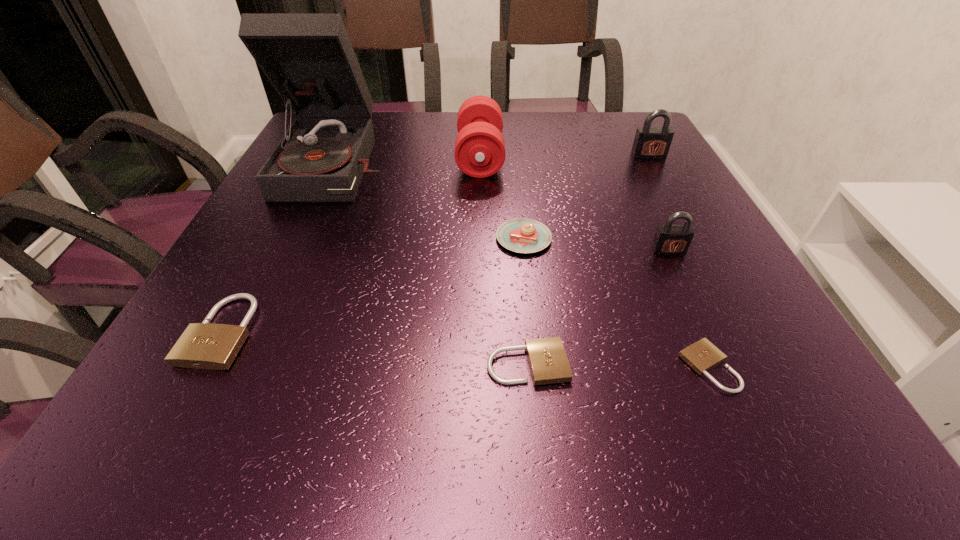
Identify the location of free spot between the third shortest padlock and the second shortest padlock. Image resolution: width=960 pixels, height=540 pixels. (374, 348).

I want to click on unoccupied position between the phonograph_record and the dumbbell, so click(409, 160).

Image resolution: width=960 pixels, height=540 pixels. Find the location of `free space between the leftmost beige padlock and the dumbbell`. free space between the leftmost beige padlock and the dumbbell is located at coordinates (351, 244).

I want to click on free spot between the dumbbell and the fourth nearest padlock, so point(574,204).

Locate an element on the screen. The image size is (960, 540). vacant space in between the biggest beige padlock and the fourth padlock from right to left is located at coordinates (374, 348).

Choose which object is the fifth nearest neighbor to the fifth tallest object. Please provide its 2D coordinates. Your answer should be formatted as a tuple, i.e. [(x, y)], where the tuple contains the x and y coordinates of a point satisfying the conditions above.

[(308, 58)]

This screenshot has width=960, height=540. In order to click on object that is the closest to the shortest object in this screenshot , I will do `click(548, 362)`.

Where is `padlock that can be found as the closest to the second farthest padlock`? The height and width of the screenshot is (540, 960). padlock that can be found as the closest to the second farthest padlock is located at coordinates (702, 356).

What are the coordinates of `padlock that is the second closest to the second shortest padlock` in the screenshot? It's located at (669, 239).

Choose which beige padlock is the third nearest neighbor to the farther gray padlock. Please provide its 2D coordinates. Your answer should be formatted as a tuple, i.e. [(x, y)], where the tuple contains the x and y coordinates of a point satisfying the conditions above.

[(205, 345)]